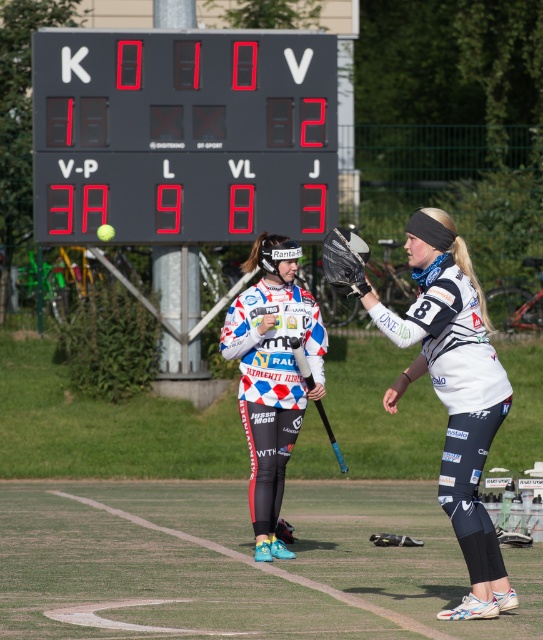
Question: Which point is farther from the camera taking this photo?

Choices:
 (A) (330, 436)
 (B) (172, 65)
 (C) (458, 349)
 (D) (270, 444)

Answer: (B)

Question: Can you confirm if white matte jersey at center is positioned to the right of blue rubber hockey bat at center?

Choices:
 (A) no
 (B) yes

Answer: (B)

Question: Among these points, which one is farthest from the camera?

Choices:
 (A) (454, 481)
 (B) (204, 70)
 (C) (299, 358)
 (D) (266, 349)

Answer: (B)

Question: Which point is closer to the camera taking this photo?

Choices:
 (A) (450, 289)
 (B) (307, 324)

Answer: (A)

Question: Does black digital scoreboard at upper center come behind white matte jersey at center?

Choices:
 (A) no
 (B) yes

Answer: (B)

Question: Is black digital scoreboard at upper center below blue rubber hockey bat at center?

Choices:
 (A) no
 (B) yes

Answer: (A)